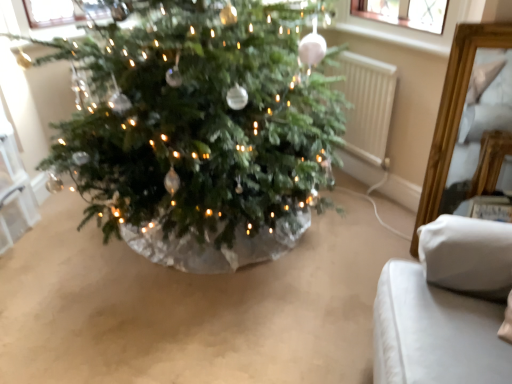
Question: Should I look upward or downward to see white fabric cushion at lower right?

Choices:
 (A) up
 (B) down

Answer: (B)

Question: Considering the relative sizes of white plastic radiator at center right and white fabric cushion at lower right in the image provided, is white plastic radiator at center right taller than white fabric cushion at lower right?

Choices:
 (A) yes
 (B) no

Answer: (B)

Question: Is white plastic radiator at center right completely or partially outside of white fabric cushion at lower right?

Choices:
 (A) yes
 (B) no

Answer: (A)

Question: Is white plastic radiator at center right positioned far away from white fabric cushion at lower right?

Choices:
 (A) no
 (B) yes

Answer: (B)

Question: Does white plastic radiator at center right appear on the left side of white fabric cushion at lower right?

Choices:
 (A) no
 (B) yes

Answer: (B)

Question: Is white plastic radiator at center right thinner than white fabric cushion at lower right?

Choices:
 (A) no
 (B) yes

Answer: (B)

Question: Can you confirm if white plastic radiator at center right is bigger than white fabric cushion at lower right?

Choices:
 (A) yes
 (B) no

Answer: (B)

Question: From the image's perspective, does white fabric cushion at lower right appear lower than white plastic radiator at center right?

Choices:
 (A) no
 (B) yes

Answer: (B)

Question: Is white fabric cushion at lower right facing away from white plastic radiator at center right?

Choices:
 (A) yes
 (B) no

Answer: (B)

Question: Is white fabric cushion at lower right in contact with white plastic radiator at center right?

Choices:
 (A) no
 (B) yes

Answer: (A)

Question: Is white fabric cushion at lower right far from white plastic radiator at center right?

Choices:
 (A) no
 (B) yes

Answer: (B)

Question: Is white fabric cushion at lower right wider than white plastic radiator at center right?

Choices:
 (A) yes
 (B) no

Answer: (A)

Question: From a real-world perspective, does white fabric cushion at lower right stand above white plastic radiator at center right?

Choices:
 (A) no
 (B) yes

Answer: (B)

Question: Would you say white plastic radiator at center right is inside or outside white fabric cushion at lower right?

Choices:
 (A) outside
 (B) inside

Answer: (A)